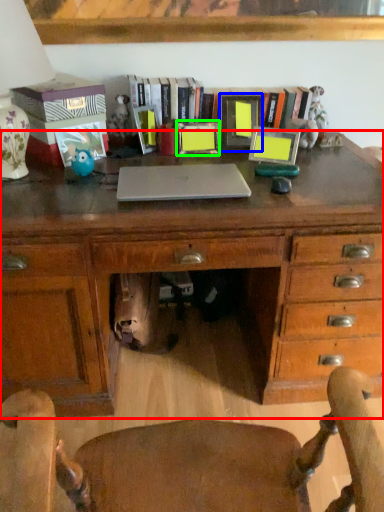
Question: Based on their relative distances, which object is nearer to desk (highlighted by a red box)? Choose from picture frame (highlighted by a blue box) and picture frame (highlighted by a green box).

Choices:
 (A) picture frame
 (B) picture frame

Answer: (A)